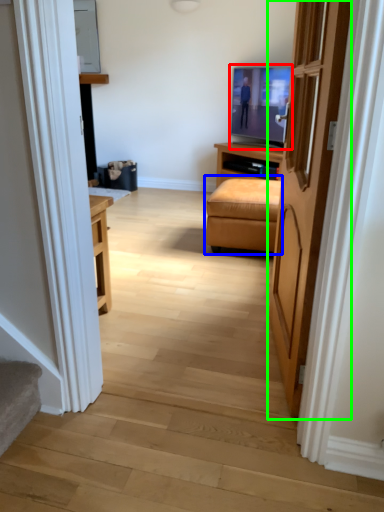
Question: Which object is positioned farthest from television (highlighted by a red box)? Select from studio couch (highlighted by a blue box) and door (highlighted by a green box).

Choices:
 (A) studio couch
 (B) door

Answer: (B)